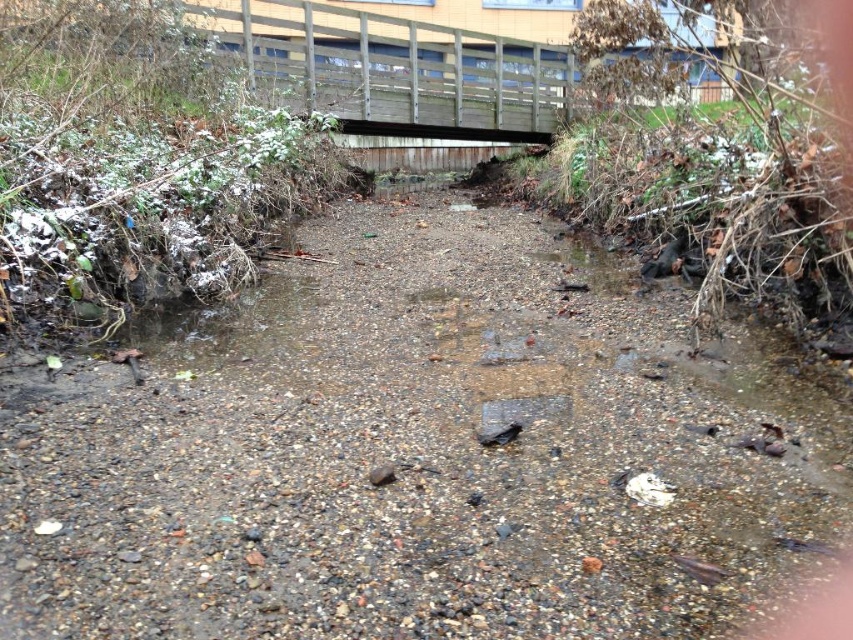
Is brown gravel path at center bigger than wooden bridge at upper center?

No, brown gravel path at center is not bigger than wooden bridge at upper center.

Which of these two, brown gravel path at center or wooden bridge at upper center, stands shorter?

brown gravel path at center is shorter.

Between point (434, 540) and point (297, 49), which one is positioned behind?

The point (297, 49) is more distant.

Where is `brown gravel path at center`? The image size is (853, 640). brown gravel path at center is located at coordinates (410, 456).